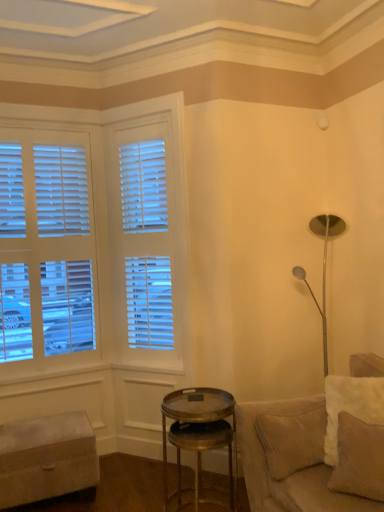
Question: Would you say beige fabric pillow at lower right is to the left or to the right of gold metallic side table at center in the picture?

Choices:
 (A) left
 (B) right

Answer: (B)

Question: From a real-world perspective, is beige fabric pillow at lower right physically located above or below gold metallic side table at center?

Choices:
 (A) above
 (B) below

Answer: (A)

Question: Estimate the real-world distances between objects in this image. Which object is closer to the beige leather couch at lower right?

Choices:
 (A) beige fabric pillow at lower right
 (B) gold metallic side table at center
 (C) beige fabric ottoman at lower left

Answer: (A)

Question: Estimate the real-world distances between objects in this image. Which object is closer to the gold metallic side table at center?

Choices:
 (A) beige fabric pillow at lower right
 (B) beige leather couch at lower right
 (C) beige fabric ottoman at lower left

Answer: (B)